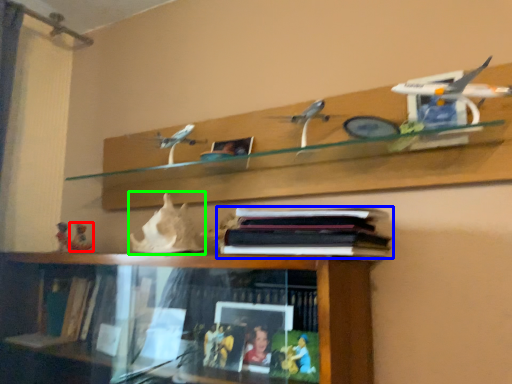
Question: Which object is the closest to the toy (highlighted by a red box)? Choose among these: book (highlighted by a blue box) or toy (highlighted by a green box).

Choices:
 (A) book
 (B) toy

Answer: (B)